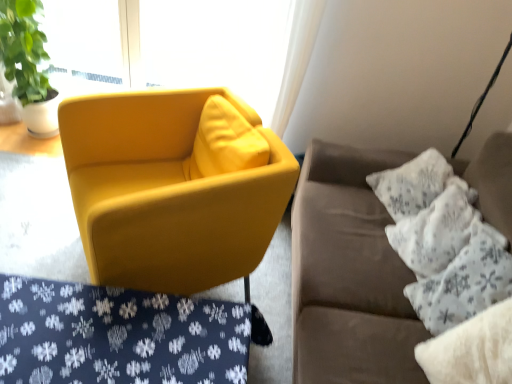
Question: From the image's perspective, is matte yellow armchair at center located above or below velvet yellow armchair at center?

Choices:
 (A) above
 (B) below

Answer: (A)

Question: Do you think matte yellow armchair at center is within velvet yellow armchair at center, or outside of it?

Choices:
 (A) inside
 (B) outside

Answer: (B)

Question: Estimate the real-world distances between objects in this image. Which object is farther from the white fluffy pillow at right, which appears as the third pillow when viewed from the back?

Choices:
 (A) white textured pillow at right, positioned as the third pillow in front-to-back order
 (B) suede couch at right
 (C) matte glass window at upper left
 (D) matte yellow armchair at center
 (E) velvet yellow armchair at center

Answer: (C)

Question: Based on their relative distances, which object is nearer to the matte yellow armchair at center?

Choices:
 (A) suede couch at right
 (B) white textured pillow at right, the second pillow in the front-to-back sequence
 (C) velvet yellow armchair at center
 (D) matte glass window at upper left
 (E) white textured pillow at right, positioned as the third pillow in front-to-back order

Answer: (C)